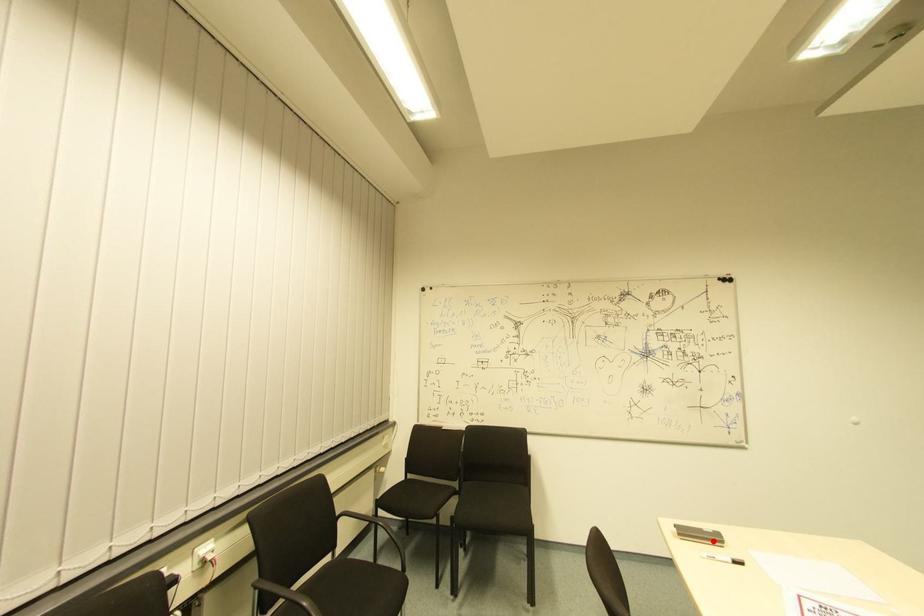
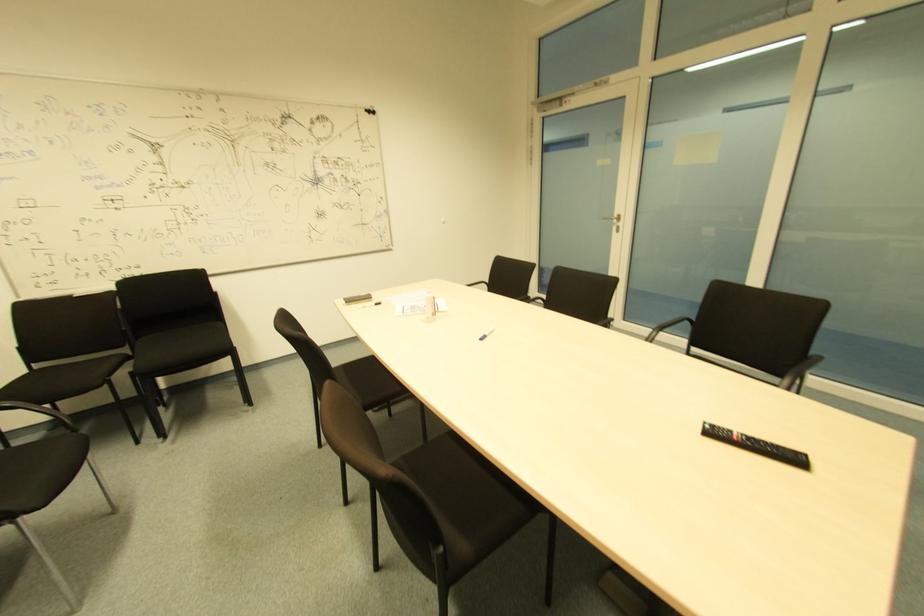
Locate, in the second image, the point that corresponds to the highlighted location in the first image.

(365, 301)